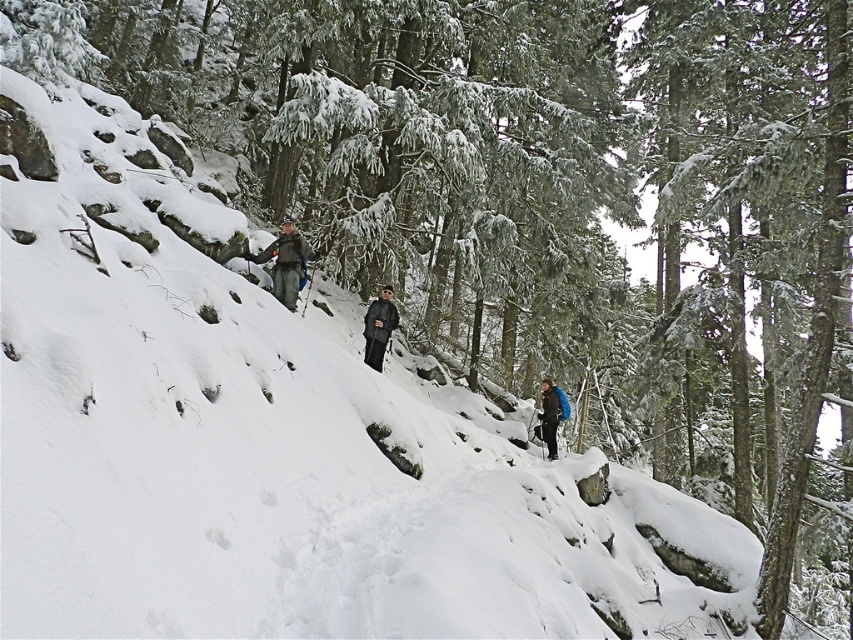
Question: Estimate the real-world distances between objects in this image. Which object is closer to the blue fabric backpack at right?

Choices:
 (A) dark gray fabric jacket at center
 (B) camouflage jacket at center

Answer: (A)

Question: Does camouflage jacket at center appear over dark gray fabric jacket at center?

Choices:
 (A) yes
 (B) no

Answer: (A)

Question: Which object is the farthest from the dark gray fabric jacket at center?

Choices:
 (A) blue fabric backpack at right
 (B) camouflage jacket at center

Answer: (A)

Question: Which point is farther from the camera taking this photo?

Choices:
 (A) (286, 243)
 (B) (378, 326)
 (C) (550, 432)

Answer: (C)

Question: Is dark gray fabric jacket at center wider than blue fabric backpack at right?

Choices:
 (A) no
 (B) yes

Answer: (A)

Question: Does camouflage jacket at center appear on the left side of blue fabric backpack at right?

Choices:
 (A) yes
 (B) no

Answer: (A)